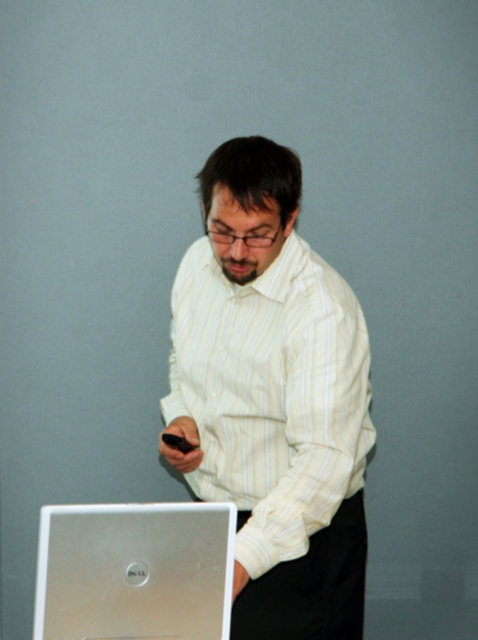
You are a photographer taking a picture of the silver metallic laptop at lower left and the black matte smartphone at center. Which object should you position closer to the left side of the frame to ensure both are visible?

The silver metallic laptop at lower left should be positioned closer to the left side of the frame since it is already to the left of the black matte smartphone at center.

You are a delivery robot standing at point (279, 273). You need to deliver a package to a person standing in front of a Dell laptop. The camera is positioned 6.14 feet away from your current position. Can you see the person from your current location?

The point (279, 273) is 6.14 feet away from the camera. Since the person is in front of the Dell laptop and the camera is positioned 6.14 feet away from your current position, you can see the person from your current location.

You are a delivery person who needs to place a package on the desk where the silver metallic laptop at lower left and the black matte smartphone at center are located. The package is 10 cm tall. Can you place it between them without moving either item?

The silver metallic laptop at lower left is much taller than the black matte smartphone at center. Since the package is only 10 cm tall, it can be placed between them as long as there is enough horizontal space, but the height difference between the two items may affect stability. However, the question only asks about placement without moving items, so yes, it can be placed there.